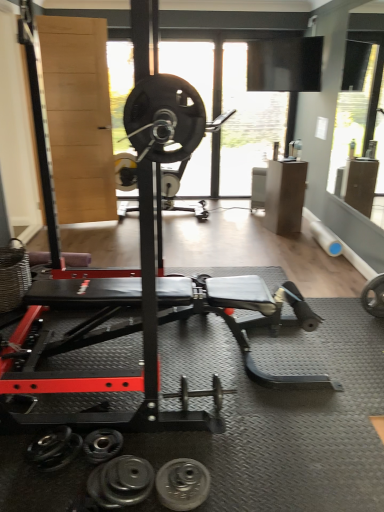
At what (x,y) coordinates should I click in order to perform the action: click on empty space that is to the right of silver metallic dumbbell at center, the first dumbbell when ordered from back to front. Please return your answer as a coordinate pair (x, y). The height and width of the screenshot is (512, 384). Looking at the image, I should click on (254, 413).